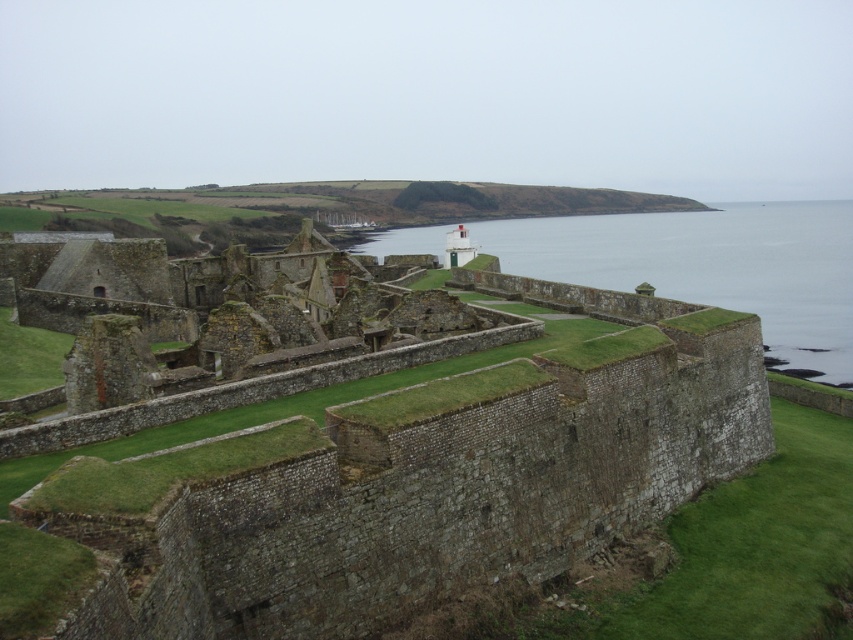
You are standing at the point marked by the coordinates point (415, 481) in the fortress. What is the nearest object to you?

The nearest object to you is the stone wall at center represented by point (415, 481).

Based on the scene of the historical fortress by the sea, which object takes up more area in the image when comparing the stone wall at center and the clear water at center?

The clear water at center occupies more area than the stone wall at center in the image.

You are a historian examining the fortress structure. You notice the stone wall at center and the clear water at center. Which of these two features appears narrower from your vantage point?

The stone wall at center is thinner than clear water at center, so the stone wall at center appears narrower from your vantage point.